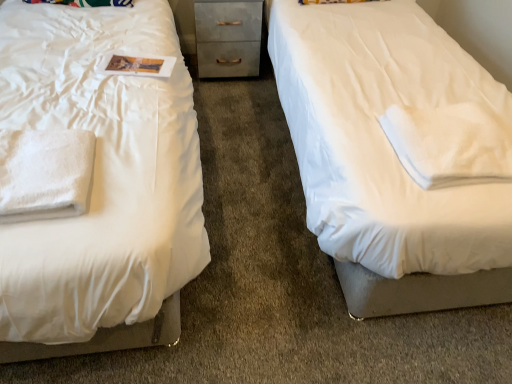
What do you see at coordinates (45, 174) in the screenshot? I see `white soft towel at left, marked as the 1th cloth in a left-to-right arrangement` at bounding box center [45, 174].

You are a GUI agent. You are given a task and a screenshot of the screen. Output one action in this format:
    pyautogui.click(x=<x>, y=<y>)
    Task: Click on the metallic gray chest of drawers at center
    Image resolution: width=512 pixels, height=384 pixels.
    Given the screenshot: What is the action you would take?
    pyautogui.click(x=228, y=38)

From a real-world perspective, is metallic gray chest of drawers at center positioned under white soft towel at left, placed as the second cloth when sorted from right to left, based on gravity?

Yes, from a real-world perspective, metallic gray chest of drawers at center is beneath white soft towel at left, placed as the second cloth when sorted from right to left.

Which object is positioned more to the right, metallic gray chest of drawers at center or white soft towel at left, placed as the second cloth when sorted from right to left?

From the viewer's perspective, metallic gray chest of drawers at center appears more on the right side.

Based on the photo, could you measure the distance between metallic gray chest of drawers at center and white soft towel at left, marked as the 1th cloth in a left-to-right arrangement?

metallic gray chest of drawers at center is 1.45 meters away from white soft towel at left, marked as the 1th cloth in a left-to-right arrangement.

In the image, there is a white soft towel at left, marked as the 1th cloth in a left-to-right arrangement. What are the coordinates of `the chest of drawers below it (from a real-world perspective)` in the screenshot? It's located at point(228,38).

Is white soft towel at left, marked as the 1th cloth in a left-to-right arrangement, directly adjacent to white soft cloth at right, which is the second cloth in left-to-right order?

No, white soft towel at left, marked as the 1th cloth in a left-to-right arrangement, is not in contact with white soft cloth at right, which is the second cloth in left-to-right order.

Does white soft towel at left, placed as the second cloth when sorted from right to left, appear on the left side of white soft cloth at right, which is the second cloth in left-to-right order?

Yes.

How much distance is there between white soft towel at left, marked as the 1th cloth in a left-to-right arrangement, and white soft cloth at right, arranged as the first cloth when viewed from the right?

They are 1.09 meters apart.

From a real-world perspective, is white soft towel at left, placed as the second cloth when sorted from right to left, physically below white soft cloth at right, which is the second cloth in left-to-right order?

Incorrect, from a real-world perspective, white soft towel at left, placed as the second cloth when sorted from right to left, is higher than white soft cloth at right, which is the second cloth in left-to-right order.

Is metallic gray chest of drawers at center positioned behind white soft cloth at right, which is the second cloth in left-to-right order?

Yes, metallic gray chest of drawers at center is further from the camera.

How many degrees apart are the facing directions of metallic gray chest of drawers at center and white soft cloth at right, arranged as the first cloth when viewed from the right?

0.656 degrees.

From the image's perspective, between metallic gray chest of drawers at center and white soft cloth at right, which is the second cloth in left-to-right order, who is located below?

From the image's view, white soft cloth at right, which is the second cloth in left-to-right order, is below.

Is white soft towel at left, placed as the second cloth when sorted from right to left, inside white soft cloth at right, which is the second cloth in left-to-right order?

No, white soft towel at left, placed as the second cloth when sorted from right to left, is located outside of white soft cloth at right, which is the second cloth in left-to-right order.

From the image's perspective, who appears lower, white soft cloth at right, which is the second cloth in left-to-right order, or white soft towel at left, marked as the 1th cloth in a left-to-right arrangement?

white soft towel at left, marked as the 1th cloth in a left-to-right arrangement, from the image's perspective.

Is point (501, 132) more distant than point (11, 140)?

Yes.

Is white soft cloth at right, which is the second cloth in left-to-right order, oriented towards metallic gray chest of drawers at center?

No, white soft cloth at right, which is the second cloth in left-to-right order, is not turned towards metallic gray chest of drawers at center.

Visually, is white soft cloth at right, arranged as the first cloth when viewed from the right, positioned to the left or to the right of metallic gray chest of drawers at center?

In the image, white soft cloth at right, arranged as the first cloth when viewed from the right, appears on the right side of metallic gray chest of drawers at center.

How distant is white soft cloth at right, arranged as the first cloth when viewed from the right, from metallic gray chest of drawers at center?

4.75 feet.

Which is closer to the camera, [399,134] or [207,40]?

Positioned in front is point [399,134].

How distant is white soft towel at left, marked as the 1th cloth in a left-to-right arrangement, from metallic gray chest of drawers at center?

white soft towel at left, marked as the 1th cloth in a left-to-right arrangement, and metallic gray chest of drawers at center are 4.75 feet apart from each other.

Is point (27, 159) closer or farther from the camera than point (207, 17)?

Point (27, 159) appears to be closer to the viewer than point (207, 17).

Which is more to the right, white soft towel at left, placed as the second cloth when sorted from right to left, or metallic gray chest of drawers at center?

From the viewer's perspective, metallic gray chest of drawers at center appears more on the right side.

At what (x,y) coordinates should I click in order to perform the action: click on chest of drawers above the white soft towel at left, placed as the second cloth when sorted from right to left (from the image's perspective). Please return your answer as a coordinate pair (x, y). Looking at the image, I should click on (228, 38).

Identify the location of cloth on the left of white soft cloth at right, which is the second cloth in left-to-right order. (45, 174).

Based on their spatial positions, is white soft towel at left, marked as the 1th cloth in a left-to-right arrangement, or white soft cloth at right, arranged as the first cloth when viewed from the right, closer to metallic gray chest of drawers at center?

The object closer to metallic gray chest of drawers at center is white soft towel at left, marked as the 1th cloth in a left-to-right arrangement.

Estimate the real-world distances between objects in this image. Which object is closer to white soft cloth at right, arranged as the first cloth when viewed from the right, white soft towel at left, placed as the second cloth when sorted from right to left, or metallic gray chest of drawers at center?

white soft towel at left, placed as the second cloth when sorted from right to left, lies closer to white soft cloth at right, arranged as the first cloth when viewed from the right, than the other object.

When comparing their distances from metallic gray chest of drawers at center, does white soft cloth at right, arranged as the first cloth when viewed from the right, or white soft towel at left, marked as the 1th cloth in a left-to-right arrangement, seem further?

Among the two, white soft cloth at right, arranged as the first cloth when viewed from the right, is located further to metallic gray chest of drawers at center.

Which object lies nearer to the anchor point white soft towel at left, placed as the second cloth when sorted from right to left, white soft cloth at right, arranged as the first cloth when viewed from the right, or metallic gray chest of drawers at center?

white soft cloth at right, arranged as the first cloth when viewed from the right, is closer to white soft towel at left, placed as the second cloth when sorted from right to left.

Considering their positions, is metallic gray chest of drawers at center positioned closer to white soft cloth at right, arranged as the first cloth when viewed from the right, than white soft towel at left, placed as the second cloth when sorted from right to left?

white soft towel at left, placed as the second cloth when sorted from right to left, is closer to white soft cloth at right, arranged as the first cloth when viewed from the right.

Considering their positions, is metallic gray chest of drawers at center positioned further to white soft towel at left, placed as the second cloth when sorted from right to left, than white soft cloth at right, arranged as the first cloth when viewed from the right?

Among the two, metallic gray chest of drawers at center is located further to white soft towel at left, placed as the second cloth when sorted from right to left.

Where is `cloth between white soft towel at left, placed as the second cloth when sorted from right to left, and metallic gray chest of drawers at center from front to back`? The image size is (512, 384). cloth between white soft towel at left, placed as the second cloth when sorted from right to left, and metallic gray chest of drawers at center from front to back is located at coordinates (450, 144).